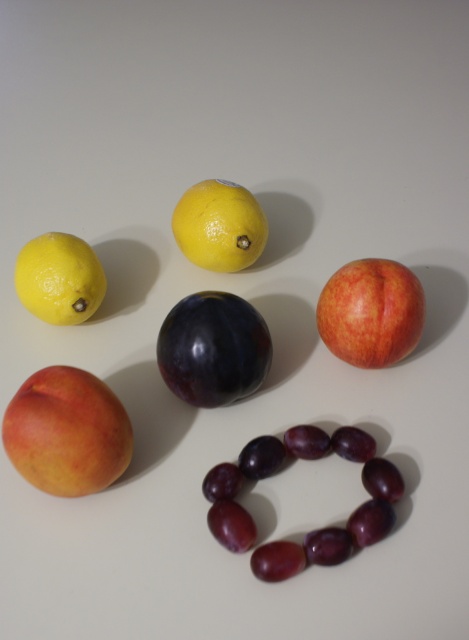
Can you confirm if shiny dark purple plum at center is taller than yellow matte lemon at center?

Correct, shiny dark purple plum at center is much taller as yellow matte lemon at center.

Which is behind, point (182, 376) or point (190, 195)?

Positioned behind is point (190, 195).

Identify the location of shiny dark purple plum at center. The image size is (469, 640). (212, 348).

Does matte peach at lower left have a larger size compared to shiny dark purple plum at center?

Correct, matte peach at lower left is larger in size than shiny dark purple plum at center.

Who is positioned more to the left, matte peach at lower left or shiny dark purple plum at center?

From the viewer's perspective, matte peach at lower left appears more on the left side.

Is point (50, 428) behind point (221, 326)?

No, (50, 428) is in front of (221, 326).

This screenshot has height=640, width=469. What are the coordinates of `matte peach at lower left` in the screenshot? It's located at (67, 433).

Does matte peach at upper right have a greater height compared to yellow matte lemon at center?

Yes, matte peach at upper right is taller than yellow matte lemon at center.

What do you see at coordinates (370, 312) in the screenshot? I see `matte peach at upper right` at bounding box center [370, 312].

Is point (338, 336) closer to camera compared to point (195, 212)?

Yes, point (338, 336) is closer to viewer.

The image size is (469, 640). In order to click on matte peach at upper right in this screenshot , I will do `click(370, 312)`.